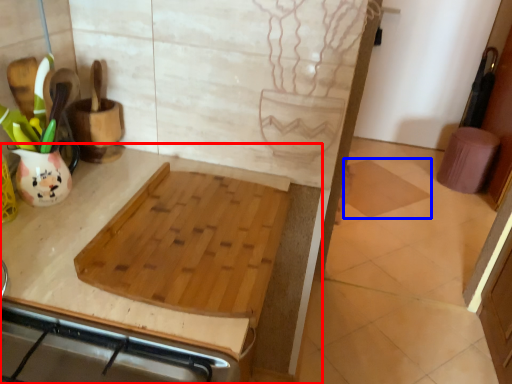
Question: Which of the following is the closest to the observer, countertop (highlighted by a red box) or tile (highlighted by a blue box)?

Choices:
 (A) countertop
 (B) tile

Answer: (A)